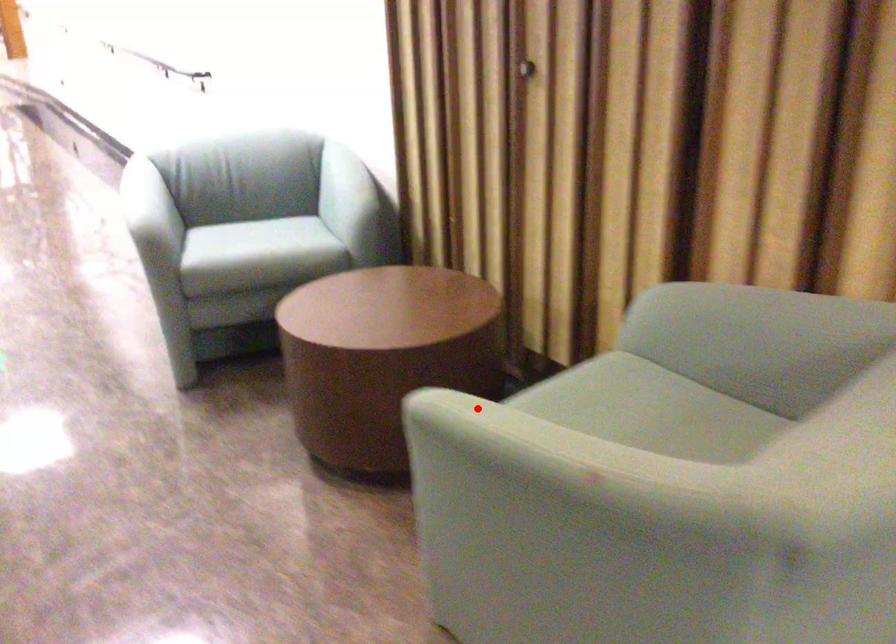
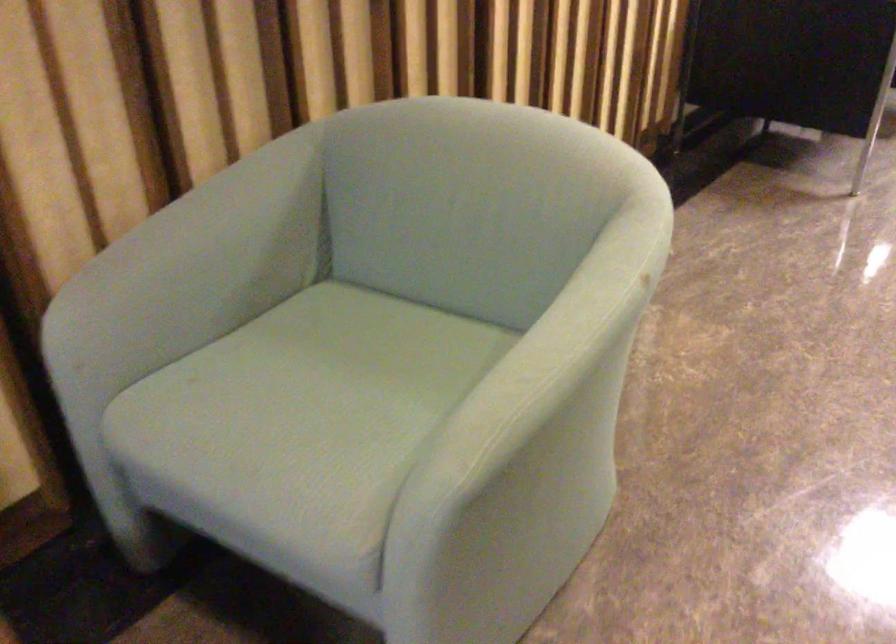
Question: I am providing you with two images of the same scene from different viewpoints. Given a red point in image1, look at the same physical point in image2. Is it:

Choices:
 (A) Closer to the viewpoint
 (B) Farther from the viewpoint

Answer: (A)